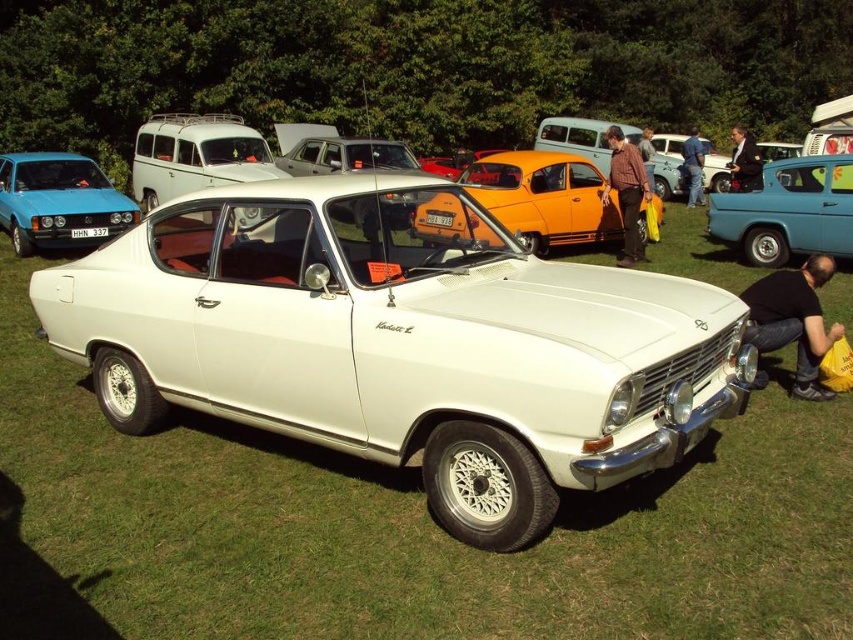
Question: Estimate the real-world distances between objects in this image. Which object is closer to the black fabric bag at lower right?

Choices:
 (A) matte blue hatchback at left
 (B) brown shirt at center
 (C) black leather jacket at center

Answer: (B)

Question: Is white matte van at upper left closer to the viewer compared to blue jeans at lower right?

Choices:
 (A) no
 (B) yes

Answer: (B)

Question: Which object is the farthest from the black fabric bag at lower right?

Choices:
 (A) orange matte car at center
 (B) blue jeans at lower right

Answer: (B)

Question: Is matte blue van at right in front of brown shirt at center?

Choices:
 (A) no
 (B) yes

Answer: (B)

Question: Can you confirm if orange matte car at center is positioned below brown shirt at center?

Choices:
 (A) yes
 (B) no

Answer: (B)

Question: Which object is farther from the camera taking this photo?

Choices:
 (A) orange matte car at center
 (B) blue jeans at lower right
 (C) black leather jacket at center

Answer: (B)